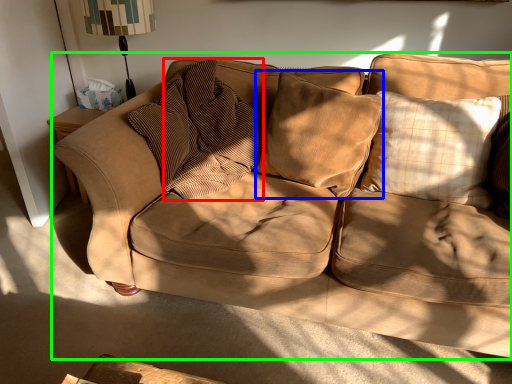
Question: Considering the real-world distances, which object is farthest from pillow (highlighted by a red box)? pillow (highlighted by a blue box) or studio couch (highlighted by a green box)?

Choices:
 (A) pillow
 (B) studio couch

Answer: (B)